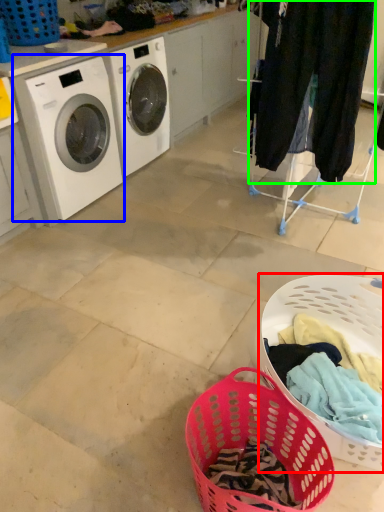
Question: Which object is positioned farthest from basket (highlighted by a red box)? Select from washing machine (highlighted by a blue box) and clothing (highlighted by a green box).

Choices:
 (A) washing machine
 (B) clothing

Answer: (A)